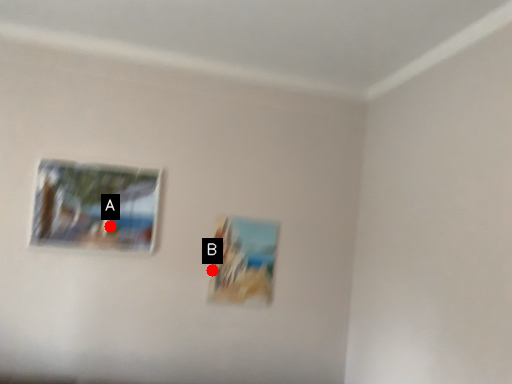
Question: Two points are circled on the image, labeled by A and B beside each circle. Which point is further to the camera?

Choices:
 (A) A is further
 (B) B is further

Answer: (B)